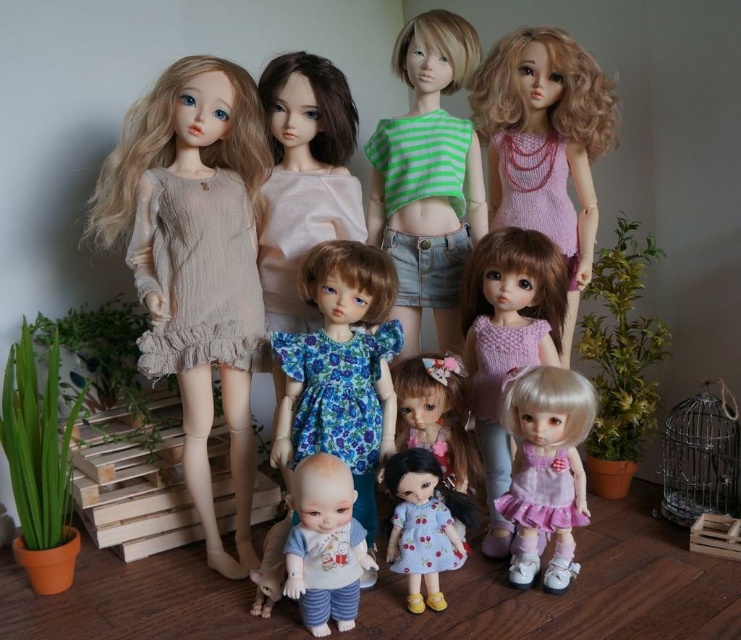
You are a photographer adjusting your camera to focus on two specific points in the image. The first point is point (328, 577) and the second is point (431, 484). Which point is closer to your camera?

Point (328, 577) is closer to the camera than point (431, 484).

You are standing in front of the dolls display and want to pick up an item located at point [285,150]. If your hand can reach up to 2 meters, will you be able to reach it?

The distance of point [285,150] from viewer is 2.12 meters, so no, you cannot reach it since it is further than your hand can extend.

You are a doll collector who wants to place both the matte beige dress at upper left and the pastel pink fabric dress at lower right on a shelf. If the shelf can only accommodate items where the taller item is placed behind the shorter one, which dress should go in front?

The pastel pink fabric dress at lower right should be placed in front since it is shorter than the matte beige dress at upper left, allowing the taller beige dress to be positioned behind without blocking the view.